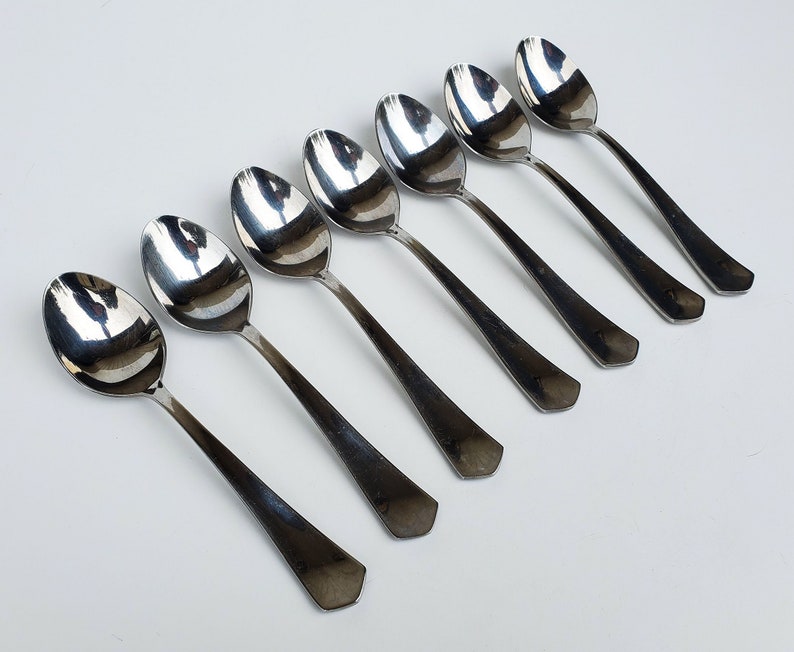
You are a GUI agent. You are given a task and a screenshot of the screen. Output one action in this format:
    pyautogui.click(x=<x>, y=<y>)
    Task: Click on the spoon
    This screenshot has width=794, height=652.
    Given the screenshot: What is the action you would take?
    pyautogui.click(x=94, y=331), pyautogui.click(x=195, y=273), pyautogui.click(x=275, y=224), pyautogui.click(x=360, y=183), pyautogui.click(x=422, y=151), pyautogui.click(x=484, y=125), pyautogui.click(x=565, y=93)